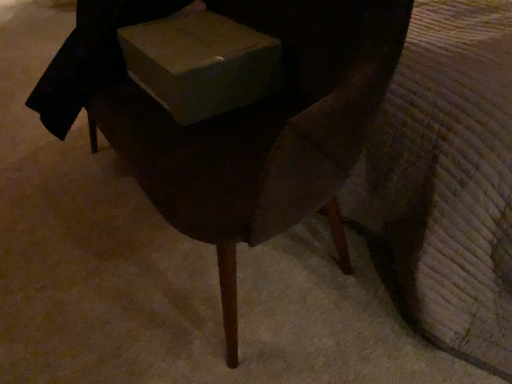
Question: Would you say matte cardboard box at center is to the left or to the right of wooden chair at center in the picture?

Choices:
 (A) left
 (B) right

Answer: (B)

Question: Is point (205, 66) closer or farther from the camera than point (309, 31)?

Choices:
 (A) closer
 (B) farther

Answer: (B)

Question: From the image's perspective, relative to wooden chair at center, is matte cardboard box at center above or below?

Choices:
 (A) above
 (B) below

Answer: (A)

Question: Based on their positions, is wooden chair at center located to the left or right of matte cardboard box at center?

Choices:
 (A) left
 (B) right

Answer: (A)

Question: Is wooden chair at center wider or thinner than matte cardboard box at center?

Choices:
 (A) wide
 (B) thin

Answer: (A)

Question: Is point (124, 97) closer or farther from the camera than point (129, 28)?

Choices:
 (A) closer
 (B) farther

Answer: (A)

Question: In terms of size, does wooden chair at center appear bigger or smaller than matte cardboard box at center?

Choices:
 (A) small
 (B) big

Answer: (B)